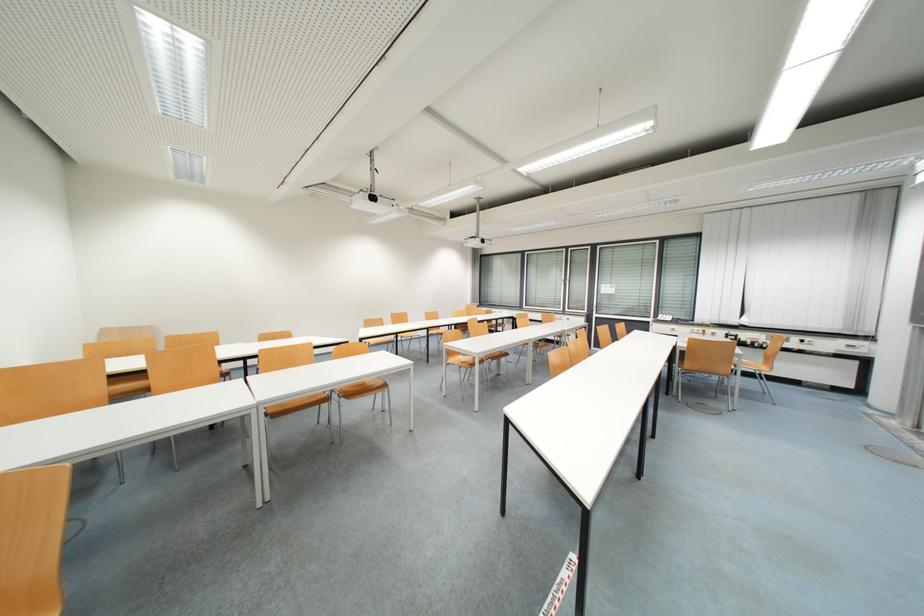
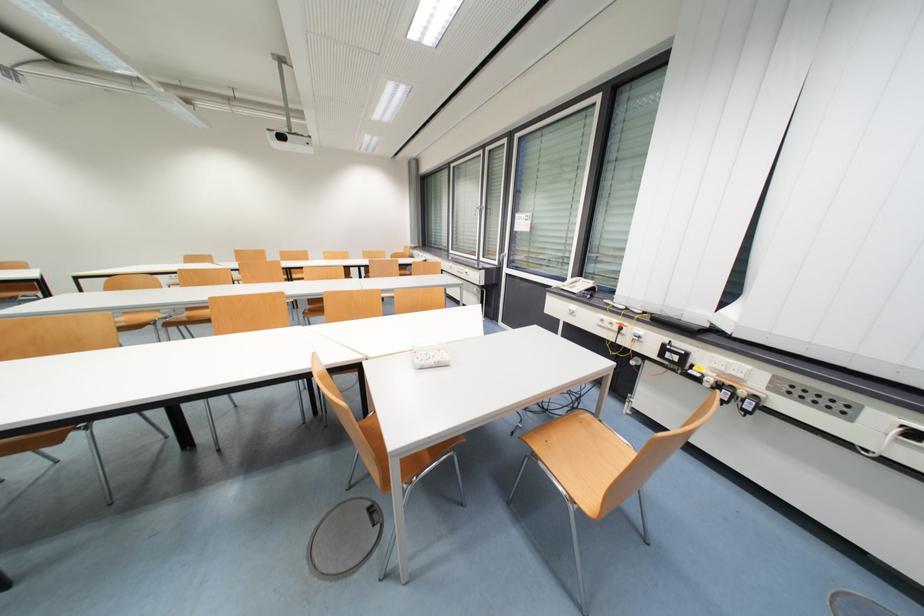
Find the pixel in the second image that matches (733,337) in the first image.

(671, 350)